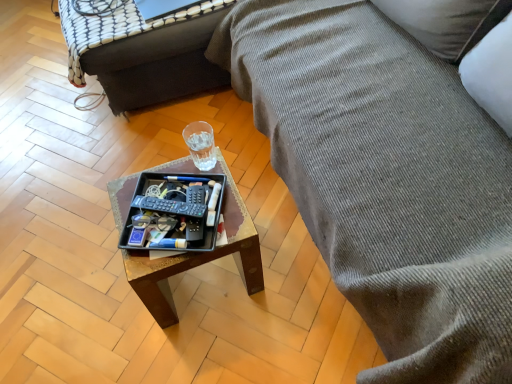
Question: From the image's perspective, is wooden tray at center on top of textured gray fabric couch at right?

Choices:
 (A) yes
 (B) no

Answer: (B)

Question: From the image's perspective, is wooden tray at center below textured gray fabric couch at right?

Choices:
 (A) yes
 (B) no

Answer: (A)

Question: Considering the relative sizes of wooden tray at center and textured gray fabric couch at right in the image provided, is wooden tray at center wider than textured gray fabric couch at right?

Choices:
 (A) no
 (B) yes

Answer: (A)

Question: Considering the relative sizes of wooden tray at center and textured gray fabric couch at right in the image provided, is wooden tray at center smaller than textured gray fabric couch at right?

Choices:
 (A) no
 (B) yes

Answer: (B)

Question: Is wooden tray at center behind textured gray fabric couch at right?

Choices:
 (A) yes
 (B) no

Answer: (A)

Question: Does wooden tray at center have a lesser width compared to textured gray fabric couch at right?

Choices:
 (A) no
 (B) yes

Answer: (B)

Question: Is wooden tray at center inside clear glass cup at center?

Choices:
 (A) no
 (B) yes

Answer: (A)

Question: Is clear glass cup at center turned away from wooden tray at center?

Choices:
 (A) no
 (B) yes

Answer: (B)

Question: Could you tell me if clear glass cup at center is facing wooden tray at center?

Choices:
 (A) yes
 (B) no

Answer: (B)

Question: Considering the relative sizes of clear glass cup at center and wooden tray at center in the image provided, is clear glass cup at center shorter than wooden tray at center?

Choices:
 (A) no
 (B) yes

Answer: (B)

Question: Is clear glass cup at center to the left of wooden tray at center from the viewer's perspective?

Choices:
 (A) no
 (B) yes

Answer: (A)

Question: Can you confirm if clear glass cup at center is taller than wooden tray at center?

Choices:
 (A) yes
 (B) no

Answer: (B)

Question: Is wooden tray at center further to camera compared to clear glass cup at center?

Choices:
 (A) yes
 (B) no

Answer: (A)